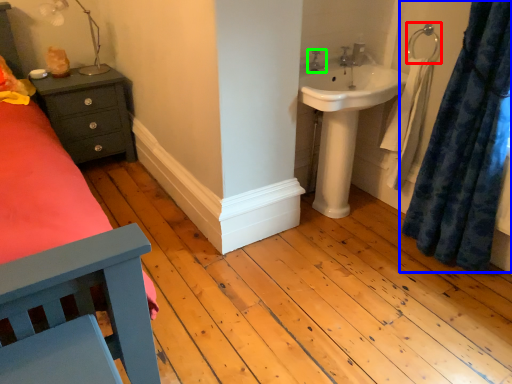
Question: Which object is positioned farthest from towel bar (highlighted by a red box)? Select from curtain (highlighted by a blue box) and tap (highlighted by a green box).

Choices:
 (A) curtain
 (B) tap

Answer: (A)